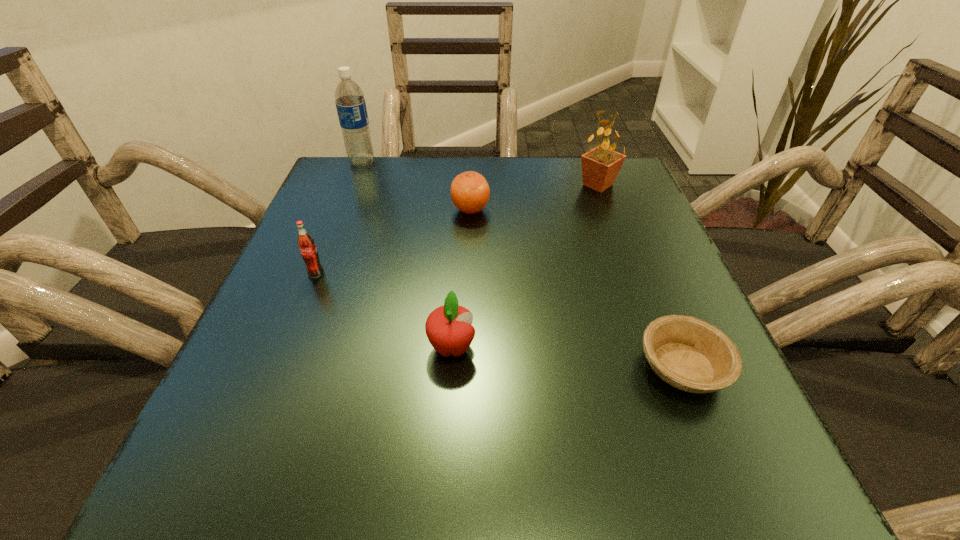
At what (x,y) coordinates should I click in order to perform the action: click on unoccupied position between the shortest object and the farthest object. Please return your answer as a coordinate pair (x, y). Looking at the image, I should click on [x=522, y=265].

What are the coordinates of `vacant area between the orange and the shortest object` in the screenshot? It's located at (576, 288).

You are a GUI agent. You are given a task and a screenshot of the screen. Output one action in this format:
    pyautogui.click(x=<x>, y=<y>)
    Task: Click on the free space between the shortest object and the apple
    
    Given the screenshot: What is the action you would take?
    pyautogui.click(x=567, y=357)

Identify which object is the nearest to the fourth shortest object. Please provide its 2D coordinates. Your answer should be formatted as a tuple, i.e. [(x, y)], where the tuple contains the x and y coordinates of a point satisfying the conditions above.

[(449, 329)]

I want to click on object that is the fourth closest to the orange, so click(x=449, y=329).

You are a GUI agent. You are given a task and a screenshot of the screen. Output one action in this format:
    pyautogui.click(x=<x>, y=<y>)
    Task: Click on the vacant space that satisfies the following two spatial constraints: 1. on the front side of the apple; 2. on the right side of the tallest object
    The image size is (960, 540).
    Given the screenshot: What is the action you would take?
    pyautogui.click(x=289, y=347)

Find the location of a particular element. The height and width of the screenshot is (540, 960). vacant space that satisfies the following two spatial constraints: 1. on the label of the apple; 2. on the right side of the fourth shortest object is located at coordinates (287, 347).

Where is `vacant space that satisfies the following two spatial constraints: 1. on the label of the third tallest object; 2. on the left side of the apple`? The image size is (960, 540). vacant space that satisfies the following two spatial constraints: 1. on the label of the third tallest object; 2. on the left side of the apple is located at coordinates [x=287, y=347].